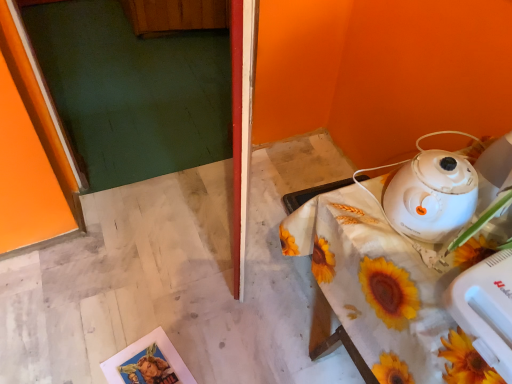
Describe the element at coordinates (486, 309) in the screenshot. I see `white plastic mixer at lower right` at that location.

Locate an element on the screen. white fabric-covered table at lower right is located at coordinates (385, 285).

Can you tell me how much white fabric-covered table at lower right and white glossy kettle at upper right differ in facing direction?

0.00639 degrees.

Who is shorter, white fabric-covered table at lower right or white glossy kettle at upper right?

white glossy kettle at upper right is shorter.

From the image's perspective, which is above, white fabric-covered table at lower right or white glossy kettle at upper right?

white glossy kettle at upper right.

Which object is further away from the camera, white fabric-covered table at lower right or white glossy kettle at upper right?

white glossy kettle at upper right is behind.

From the image's perspective, is white glossy kettle at upper right below white fabric-covered table at lower right?

No, from the image's perspective, white glossy kettle at upper right is not beneath white fabric-covered table at lower right.

Find the location of a particular element. kettle above the white fabric-covered table at lower right (from the image's perspective) is located at coordinates (432, 194).

Based on the photo, could you tell me if white glossy kettle at upper right is turned towards white fabric-covered table at lower right?

No.

Is white glossy kettle at upper right at the back of white plastic mixer at lower right?

No, white plastic mixer at lower right is not facing away from white glossy kettle at upper right.

Measure the distance from white plastic mixer at lower right to white glossy kettle at upper right.

white plastic mixer at lower right and white glossy kettle at upper right are 6.35 inches apart.

In the scene shown: Is white plastic mixer at lower right taller or shorter than white glossy kettle at upper right?

Considering their sizes, white plastic mixer at lower right has less height than white glossy kettle at upper right.

Are white plastic mixer at lower right and white glossy kettle at upper right beside each other?

No, white plastic mixer at lower right is not in contact with white glossy kettle at upper right.

Does white fabric-covered table at lower right have a lesser width compared to white plastic mixer at lower right?

No.

This screenshot has height=384, width=512. Find the location of `table located behind the white plastic mixer at lower right`. table located behind the white plastic mixer at lower right is located at coordinates (385, 285).

Is white fabric-covered table at lower right in front of or behind white plastic mixer at lower right in the image?

In the image, white fabric-covered table at lower right appears behind white plastic mixer at lower right.

From the image's perspective, between white fabric-covered table at lower right and white plastic mixer at lower right, who is located below?

From the image's view, white fabric-covered table at lower right is below.

Between white plastic mixer at lower right and white fabric-covered table at lower right, which one has larger size?

Bigger between the two is white fabric-covered table at lower right.

Which object is positioned more to the left, white plastic mixer at lower right or white fabric-covered table at lower right?

white plastic mixer at lower right.

The width and height of the screenshot is (512, 384). In order to click on appliance in front of the white fabric-covered table at lower right in this screenshot , I will do `click(486, 309)`.

From a real-world perspective, between white plastic mixer at lower right and white fabric-covered table at lower right, who is vertically lower?

From a 3D spatial view, white fabric-covered table at lower right is below.

Looking at this image, is white glossy kettle at upper right beside white plastic mixer at lower right?

No.

Is white glossy kettle at upper right looking in the opposite direction of white plastic mixer at lower right?

No, white glossy kettle at upper right is not facing away from white plastic mixer at lower right.

Can you tell me how much white glossy kettle at upper right and white plastic mixer at lower right differ in facing direction?

They differ by 3.85 degrees in their facing directions.

From a real-world perspective, is white glossy kettle at upper right below white plastic mixer at lower right?

No, from a real-world perspective, white glossy kettle at upper right is not below white plastic mixer at lower right.

Where is `kettle above the white fabric-covered table at lower right (from a real-world perspective)`? This screenshot has width=512, height=384. kettle above the white fabric-covered table at lower right (from a real-world perspective) is located at coordinates (432, 194).

Where is `kettle above the white fabric-covered table at lower right (from the image's perspective)`? The width and height of the screenshot is (512, 384). kettle above the white fabric-covered table at lower right (from the image's perspective) is located at coordinates (x=432, y=194).

Considering their positions, is white glossy kettle at upper right positioned further to white fabric-covered table at lower right than white plastic mixer at lower right?

white plastic mixer at lower right is further to white fabric-covered table at lower right.

Estimate the real-world distances between objects in this image. Which object is closer to white glossy kettle at upper right, white fabric-covered table at lower right or white plastic mixer at lower right?

white fabric-covered table at lower right.

Looking at the image, which one is located closer to white fabric-covered table at lower right, white plastic mixer at lower right or white glossy kettle at upper right?

white glossy kettle at upper right is positioned closer to the anchor white fabric-covered table at lower right.

Looking at the image, which one is located further to white glossy kettle at upper right, white plastic mixer at lower right or white fabric-covered table at lower right?

The object further to white glossy kettle at upper right is white plastic mixer at lower right.

Based on their spatial positions, is white fabric-covered table at lower right or white glossy kettle at upper right further from white plastic mixer at lower right?

The object further to white plastic mixer at lower right is white glossy kettle at upper right.

Considering their positions, is white glossy kettle at upper right positioned further to white plastic mixer at lower right than white fabric-covered table at lower right?

Based on the image, white glossy kettle at upper right appears to be further to white plastic mixer at lower right.

This screenshot has width=512, height=384. I want to click on appliance between white glossy kettle at upper right and white fabric-covered table at lower right from top to bottom, so click(x=486, y=309).